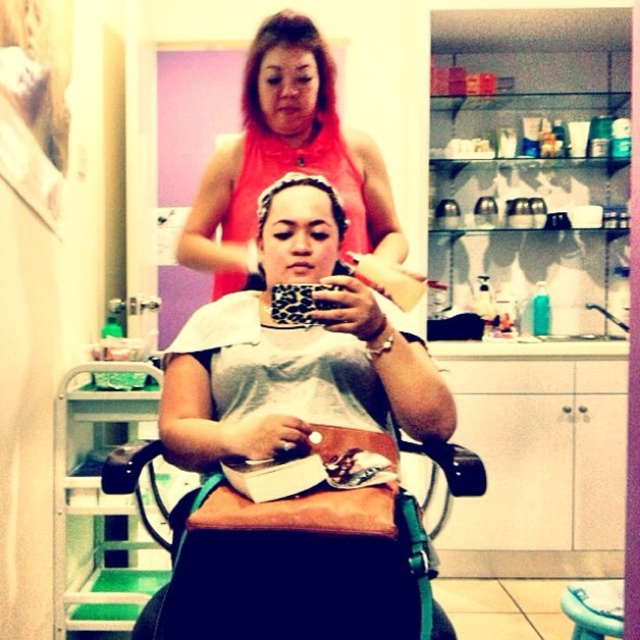
You are a customer in a beauty salon and you want to know which item is closer to you between the pink matte tank top at upper center and the brown shiny hair at upper center. Can you tell me?

The pink matte tank top at upper center is closer to the viewer than the brown shiny hair at upper center, so the pink matte tank top at upper center is closer to you.

You are a customer in a beauty salon and want to check if your brown shiny hair at upper center is within reach of the stylist who is standing 6 feet away from you. Can you confirm if the stylist can easily access your hair?

The brown shiny hair at upper center is 5.77 feet away from viewer, which is slightly closer than the stylist who is 6 feet away. Therefore, the stylist can easily access your hair.